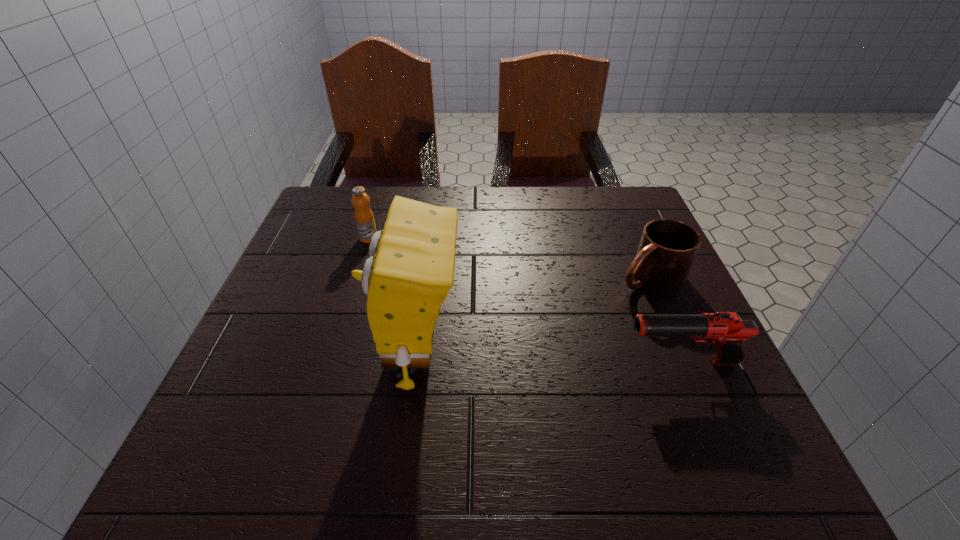
The width and height of the screenshot is (960, 540). In order to click on vacant space on the desktop that is between the sponge and the gun and is positioned on the side of the mug with the handle in this screenshot , I will do `click(512, 359)`.

Image resolution: width=960 pixels, height=540 pixels. I want to click on free space on the desktop that is between the sponge and the gun and is positioned on the front label of the orange juice, so click(514, 359).